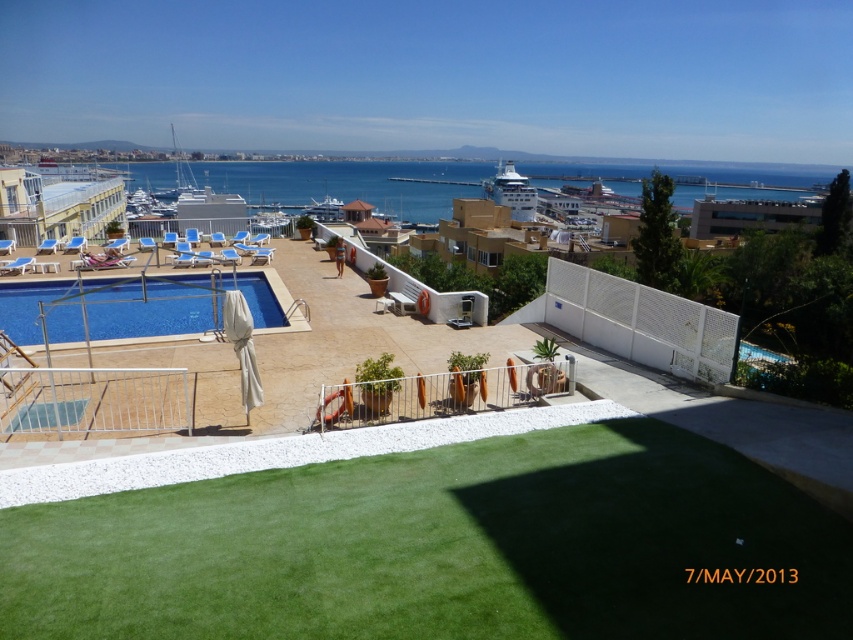
Question: Among these objects, which one is farthest from the camera?

Choices:
 (A) white glossy cruise ship at center
 (B) blue water at center
 (C) white glossy building at left
 (D) blue glossy pool at lower left

Answer: (A)

Question: Is blue water at center wider than white glossy cruise ship at center?

Choices:
 (A) no
 (B) yes

Answer: (B)

Question: Among these points, which one is nearest to the camera?

Choices:
 (A) (3, 314)
 (B) (65, 188)
 (C) (529, 218)

Answer: (A)

Question: Is blue water at center bigger than blue glossy pool at lower left?

Choices:
 (A) no
 (B) yes

Answer: (B)

Question: Which of the following is the closest to the observer?

Choices:
 (A) white glossy building at left
 (B) white glossy cruise ship at center
 (C) blue glossy pool at lower left
 (D) blue water at center

Answer: (C)

Question: Is the position of blue water at center more distant than that of white glossy cruise ship at center?

Choices:
 (A) yes
 (B) no

Answer: (B)